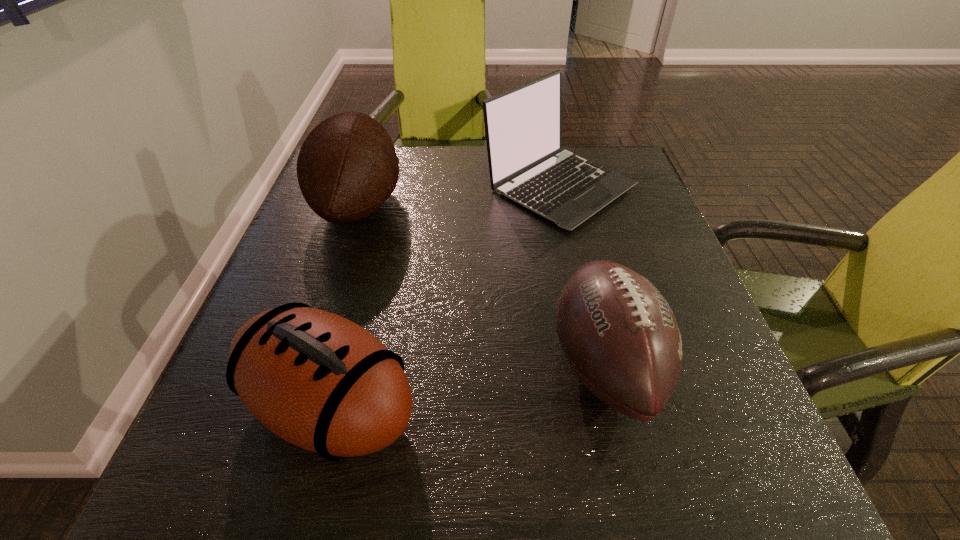
Identify the location of vacant space that satisfies the following two spatial constraints: 1. on the laces of the rightmost football (American); 2. on the left side of the farthest football (American). This screenshot has width=960, height=540. (306, 364).

Identify the location of free region that satisfies the following two spatial constraints: 1. on the laces of the rightmost football (American); 2. on the left side of the farthest football (American). (306, 364).

Identify the location of vacant space that satisfies the following two spatial constraints: 1. at the front screen of the laptop_computer; 2. on the laces of the farthest football (American). pyautogui.click(x=564, y=205).

You are a GUI agent. You are given a task and a screenshot of the screen. Output one action in this format:
    pyautogui.click(x=<x>, y=<y>)
    Task: Click on the free location that satisfies the following two spatial constraints: 1. at the front screen of the laptop_computer; 2. on the laces of the farthest football (American)
    The height and width of the screenshot is (540, 960).
    Given the screenshot: What is the action you would take?
    pyautogui.click(x=564, y=205)